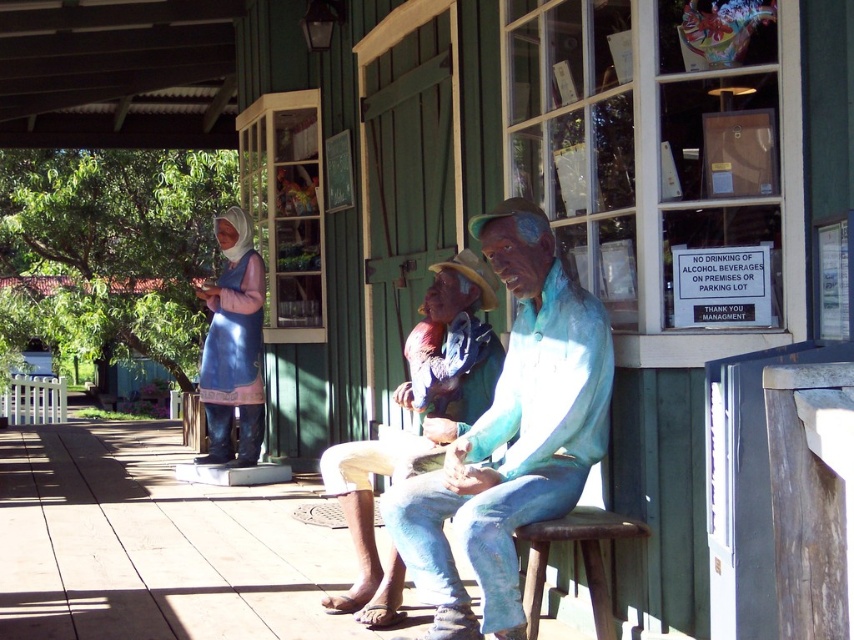
Question: Which of the following is the closest to the observer?

Choices:
 (A) (463, 291)
 (B) (524, 579)
 (C) (480, 504)

Answer: (C)

Question: Among these objects, which one is farthest from the camera?

Choices:
 (A) matte blue statue at center
 (B) matte green statue at center
 (C) rustic wood stool at lower right

Answer: (B)

Question: Estimate the real-world distances between objects in this image. Which object is farther from the matte green statue at center?

Choices:
 (A) rustic wood stool at lower right
 (B) matte blue statue at center

Answer: (A)

Question: Is matte blue statue at center further to camera compared to rustic wood stool at lower right?

Choices:
 (A) yes
 (B) no

Answer: (B)

Question: Is matte blue statue at center above matte green statue at center?

Choices:
 (A) yes
 (B) no

Answer: (A)

Question: Is matte green statue at center thinner than rustic wood stool at lower right?

Choices:
 (A) no
 (B) yes

Answer: (A)